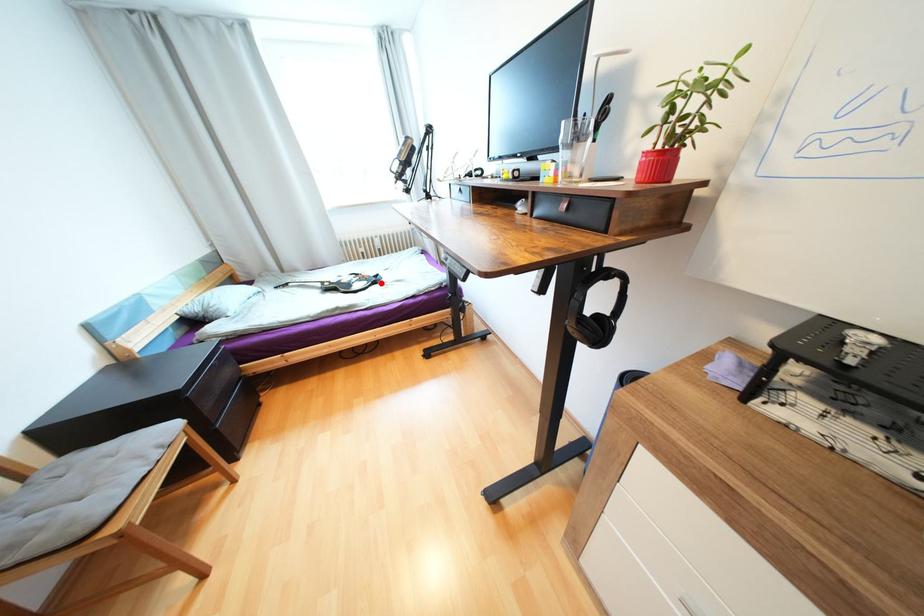
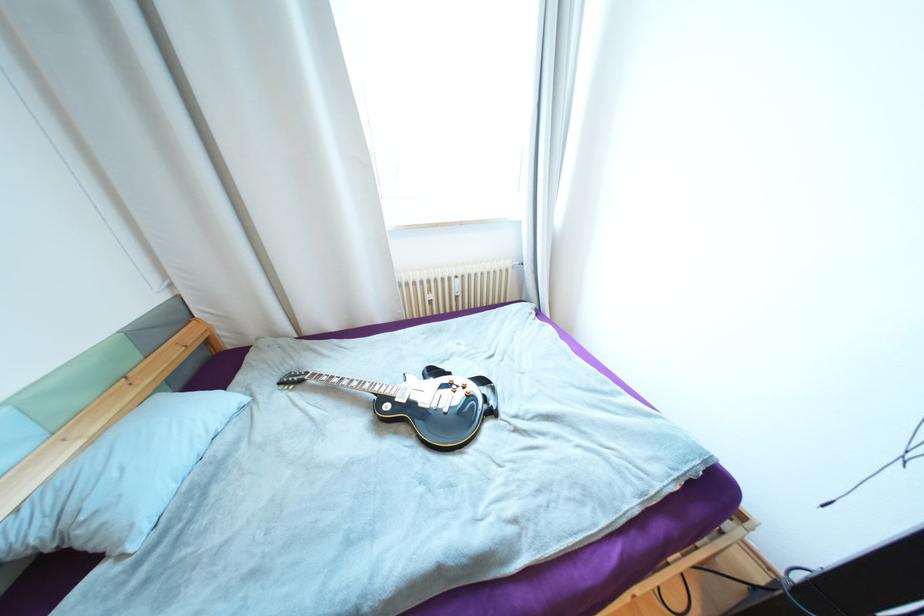
Find the pixel in the second image that matches the highlighted location in the first image.

(497, 413)